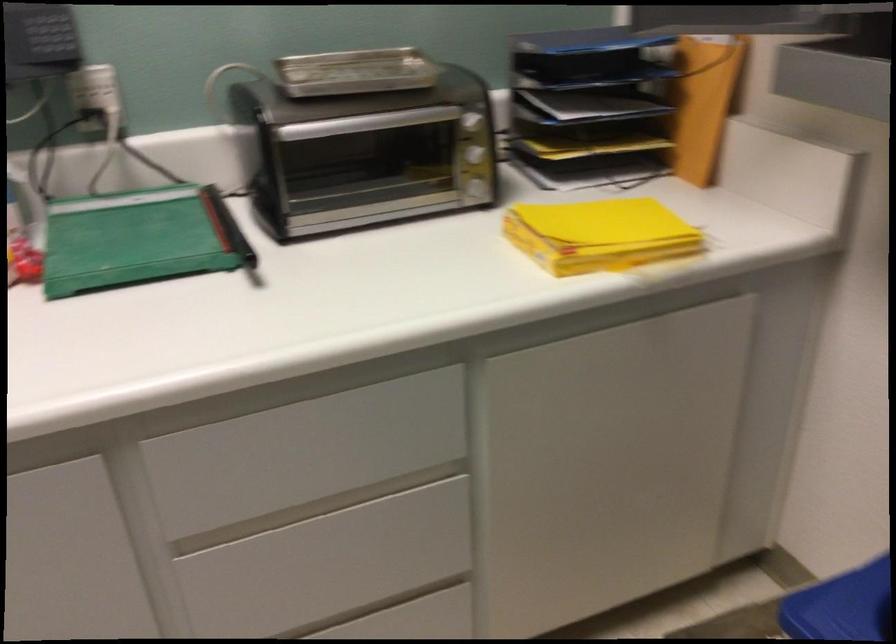
Identify the location of yellow folder stack. (599, 234).